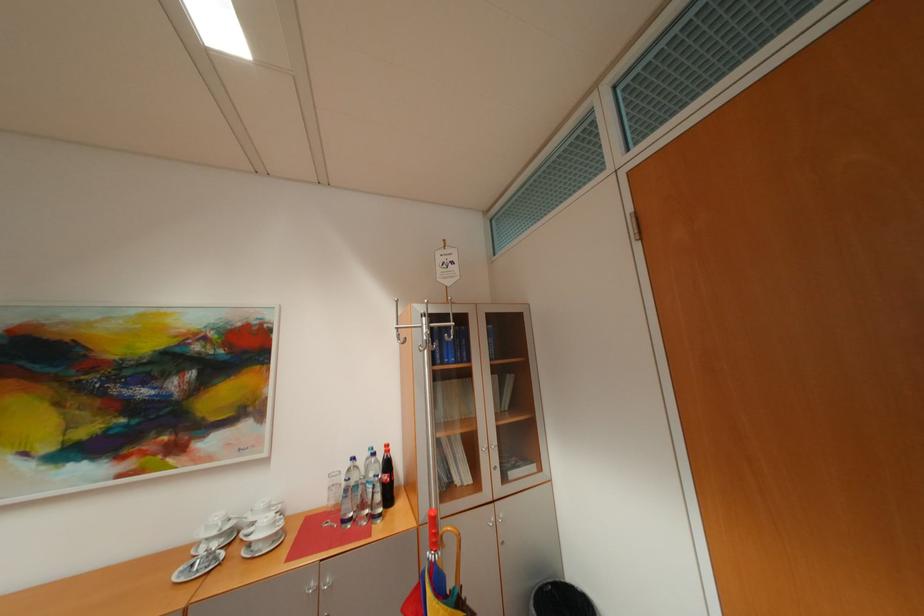
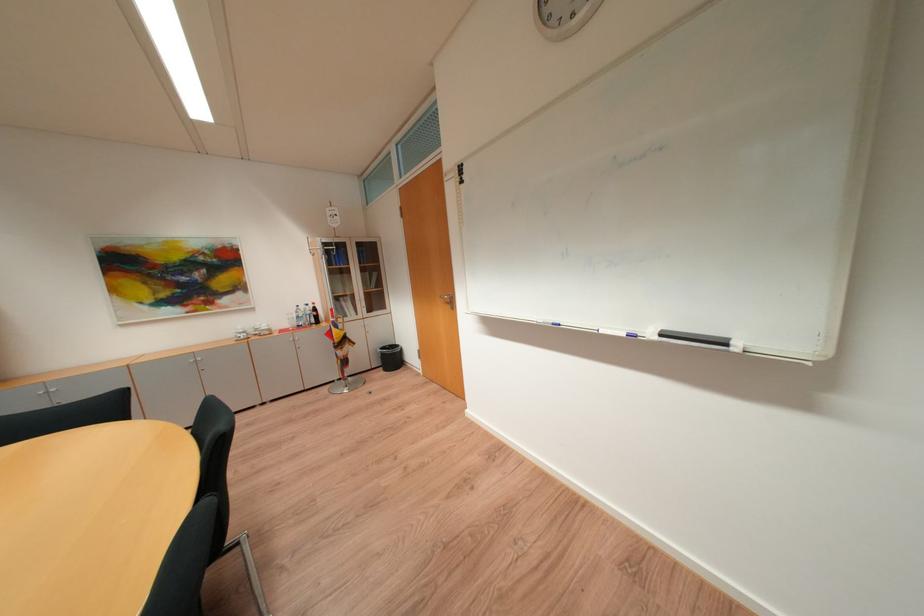
In the second image, find the point that corresponds to (x=371, y=461) in the first image.

(310, 309)